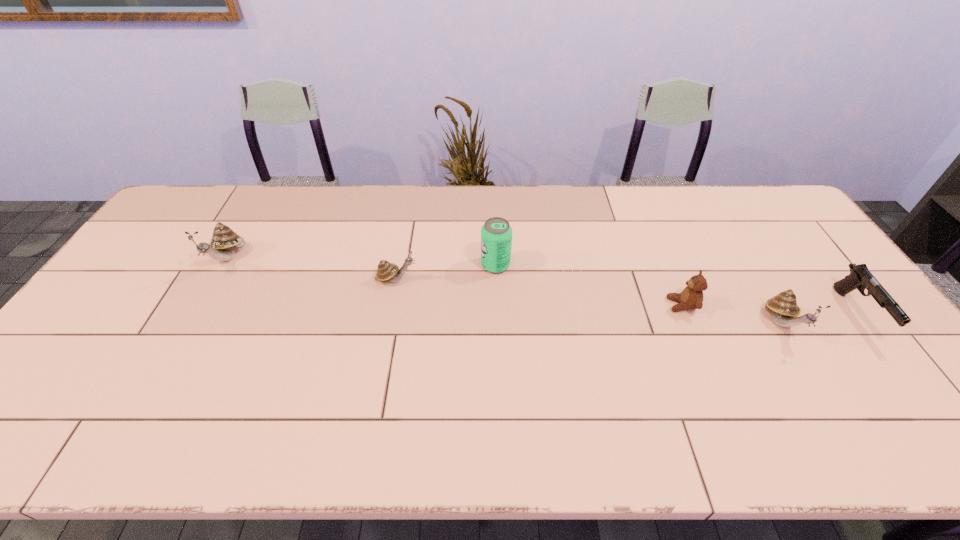
To make them evenly spaced by inserting another escargot among them, please locate a free space for this new escargot. Please provide its 2D coordinates. Your answer should be formatted as a tuple, i.e. [(x, y)], where the tuple contains the x and y coordinates of a point satisfying the conditions above.

[(581, 300)]